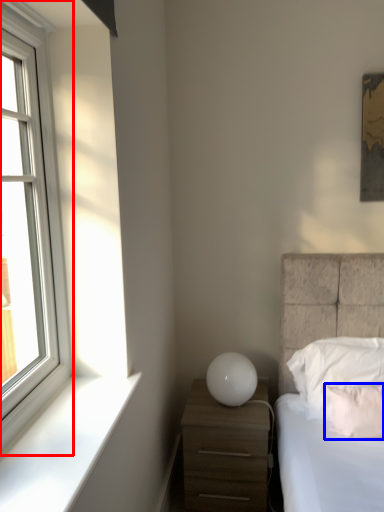
Question: Among these objects, which one is farthest to the camera, window (highlighted by a red box) or pillow (highlighted by a blue box)?

Choices:
 (A) window
 (B) pillow

Answer: (B)